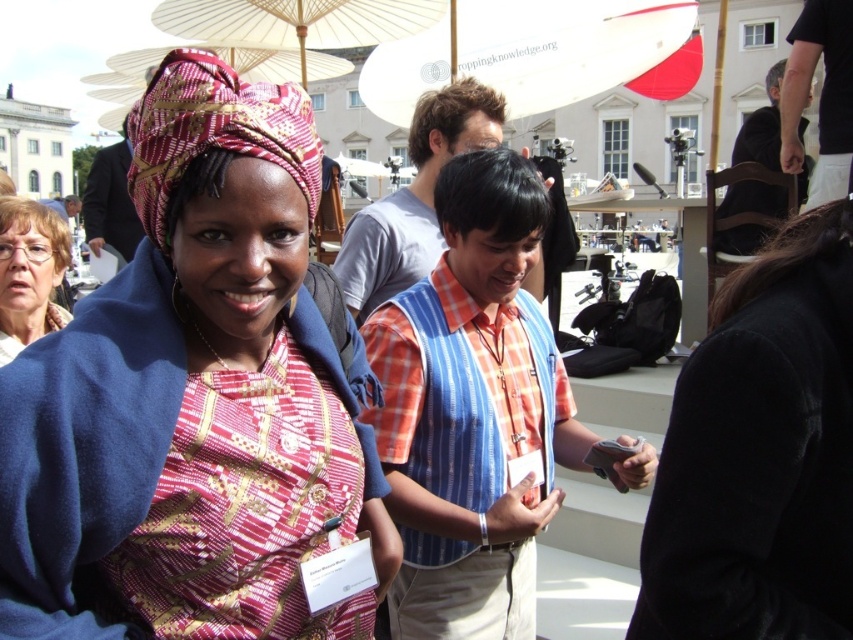
Between white matte umbrella at upper center and matte black glasses at upper left, which one appears on the left side from the viewer's perspective?

matte black glasses at upper left

Is point (389, 122) closer to viewer compared to point (20, 209)?

No, (389, 122) is further to viewer.

Is point (434, 49) positioned before point (55, 243)?

No.

Where is `white matte umbrella at upper center`? white matte umbrella at upper center is located at coordinates (566, 45).

Is the position of printed fabric headscarf at center more distant than that of matte black glasses at upper left?

No.

Which is below, printed fabric headscarf at center or matte black glasses at upper left?

printed fabric headscarf at center is below.

Is point (144, 200) positioned behind point (13, 333)?

That is False.

At what (x,y) coordinates should I click in order to perform the action: click on printed fabric headscarf at center. Please return your answer as a coordinate pair (x, y). The height and width of the screenshot is (640, 853). Looking at the image, I should click on (213, 131).

Can you confirm if matte fabric headscarf at upper left is taller than white matte umbrella at upper center?

Yes, matte fabric headscarf at upper left is taller than white matte umbrella at upper center.

Is point (90, 340) in front of point (595, 33)?

Yes.

Identify the location of matte fabric headscarf at upper left. This screenshot has width=853, height=640. (194, 397).